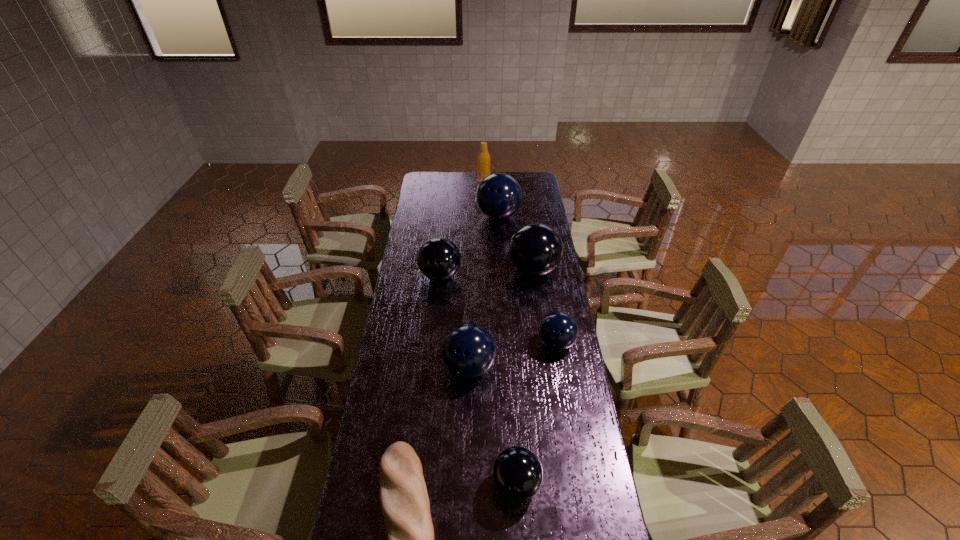
You are a GUI agent. You are given a task and a screenshot of the screen. Output one action in this format:
    pyautogui.click(x=<x>, y=<y>)
    Task: Click on the beer bottle
    The width and height of the screenshot is (960, 540).
    Given the screenshot: What is the action you would take?
    pyautogui.click(x=483, y=159)

Find the location of `tan beer bottle`. tan beer bottle is located at coordinates (483, 159).

Locate an element on the screen. the farthest bowling ball is located at coordinates (499, 196).

I want to click on the farthest blue bowling ball, so click(499, 196).

Where is `the biggest black bowling ball`? The height and width of the screenshot is (540, 960). the biggest black bowling ball is located at coordinates (536, 249).

The image size is (960, 540). Identify the location of the second biggest black bowling ball. pyautogui.click(x=438, y=259).

Find the location of a particular element. The image size is (960, 540). the second smallest blue bowling ball is located at coordinates (468, 351).

The image size is (960, 540). In order to click on the nearest black bowling ball in this screenshot , I will do `click(517, 472)`.

Where is `the smallest black bowling ball`? The image size is (960, 540). the smallest black bowling ball is located at coordinates (517, 472).

The image size is (960, 540). Find the location of `the smallest blue bowling ball`. the smallest blue bowling ball is located at coordinates (559, 330).